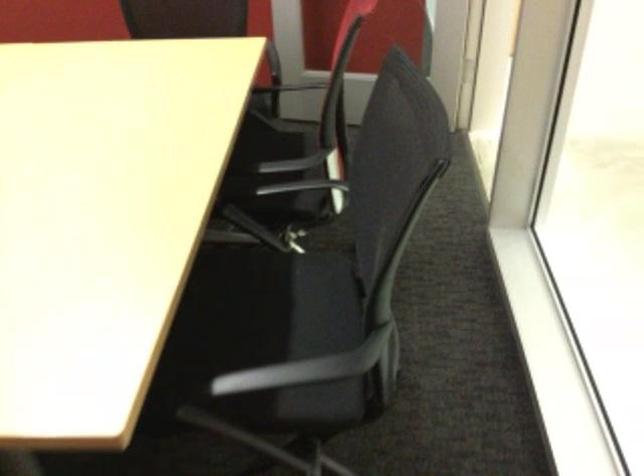
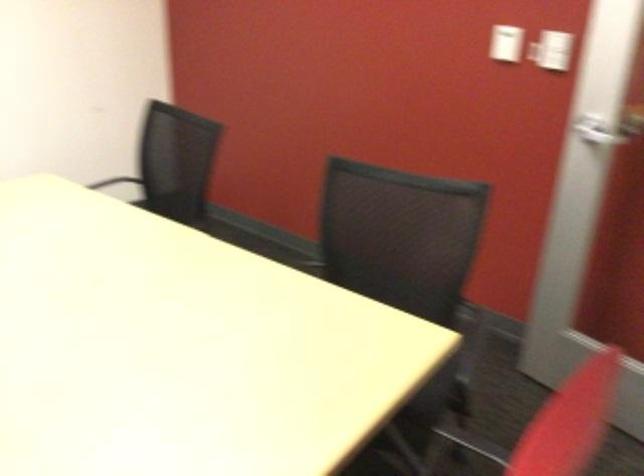
Question: Based on the continuous images, in which direction is the camera rotating? Reply with the corresponding letter.

Choices:
 (A) Left
 (B) Right
 (C) Up
 (D) Down

Answer: (A)